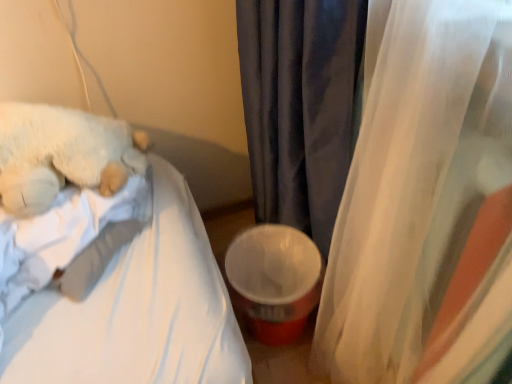
Question: Based on their positions, is translucent fabric curtain at right, which ranks as the first curtain in right-to-left order, located to the left or right of velvet dark gray curtain at center, acting as the 1th curtain starting from the left?

Choices:
 (A) right
 (B) left

Answer: (A)

Question: From the image's perspective, is translucent fabric curtain at right, the 2th curtain from the left, located above or below velvet dark gray curtain at center, acting as the 1th curtain starting from the left?

Choices:
 (A) below
 (B) above

Answer: (A)

Question: Based on their relative distances, which object is nearer to the velvet dark gray curtain at center, acting as the second curtain starting from the right?

Choices:
 (A) white fluffy teddy bear at left
 (B) white soft fabric mattress at upper left
 (C) translucent fabric curtain at right, the 2th curtain from the left

Answer: (C)

Question: Based on their relative distances, which object is farther from the velvet dark gray curtain at center, acting as the 1th curtain starting from the left?

Choices:
 (A) white soft fabric mattress at upper left
 (B) white fluffy teddy bear at left
 (C) translucent fabric curtain at right, which ranks as the first curtain in right-to-left order

Answer: (B)